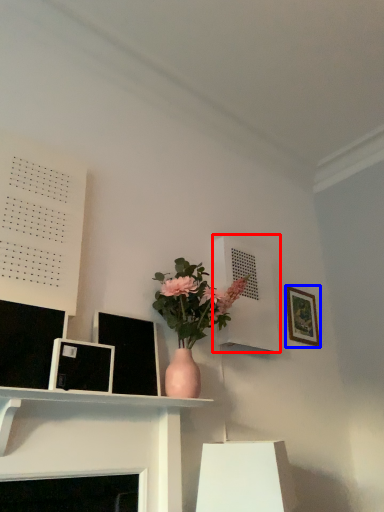
Question: Which object is closer to the camera taking this photo, shelf (highlighted by a red box) or picture frame (highlighted by a blue box)?

Choices:
 (A) shelf
 (B) picture frame

Answer: (A)